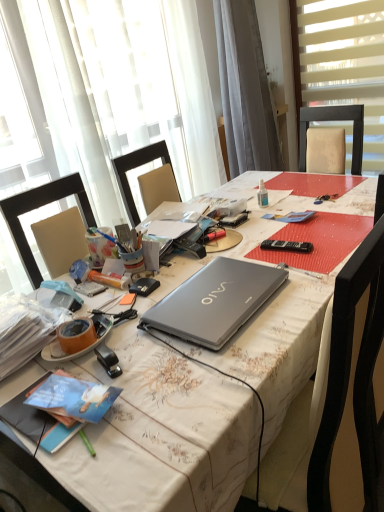
Find the location of a particular element. free space in front of black plastic remote control at center is located at coordinates coord(182,268).